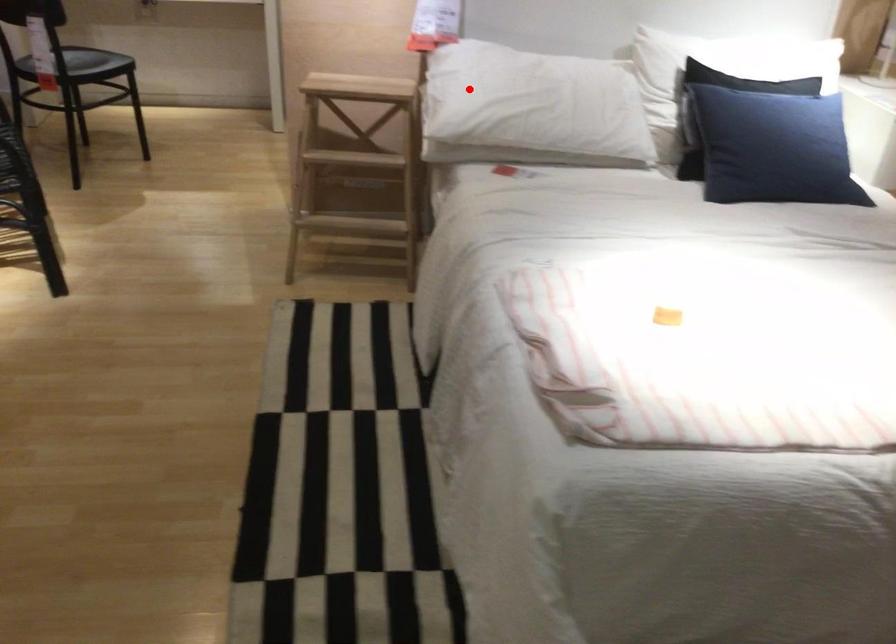
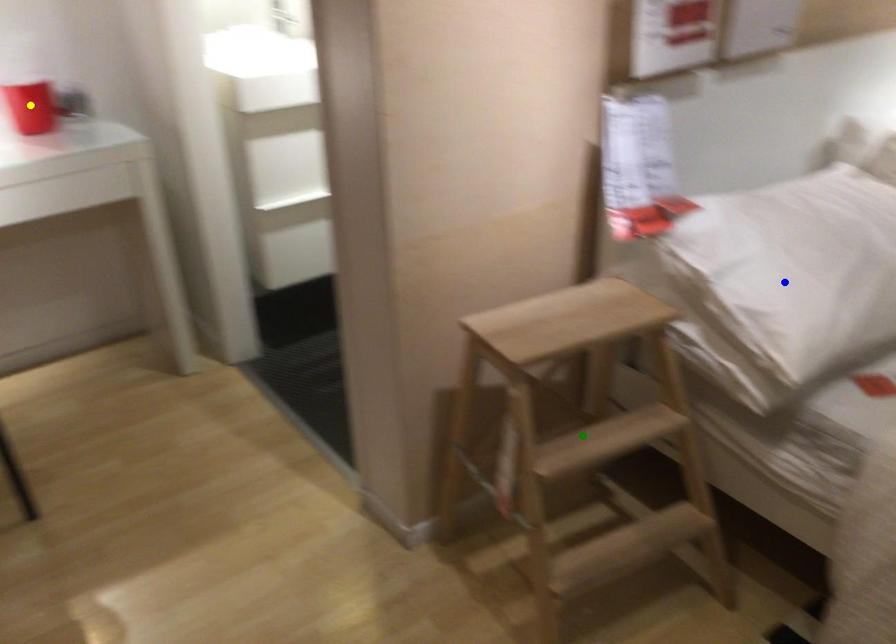
Question: I am providing you with two images of the same scene from different viewpoints. A red point is marked on the first image. You are given multiple points on the second image. Which spot in image 2 lines up with the point in image 1?

Choices:
 (A) blue point
 (B) yellow point
 (C) green point

Answer: (A)